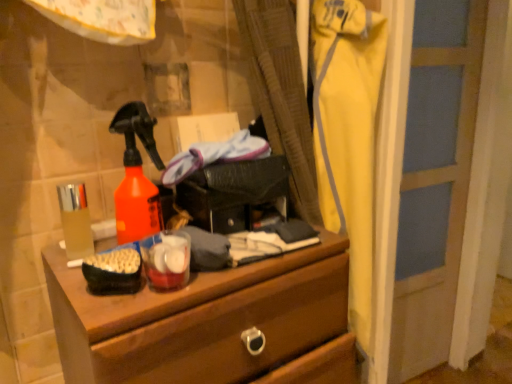
Question: Considering the positions of point [131, 360] and point [317, 155], is point [131, 360] closer or farther from the camera than point [317, 155]?

Choices:
 (A) farther
 (B) closer

Answer: (B)

Question: Which is correct: wooden chest of drawers at center is inside yellow fabric pants at right, or outside of it?

Choices:
 (A) outside
 (B) inside

Answer: (A)

Question: Which object is positioned closest to the translucent plastic cup at left?

Choices:
 (A) yellow fabric pants at right
 (B) wooden chest of drawers at center

Answer: (B)

Question: Which of these objects is positioned farthest from the yellow fabric pants at right?

Choices:
 (A) translucent plastic cup at left
 (B) wooden chest of drawers at center

Answer: (A)